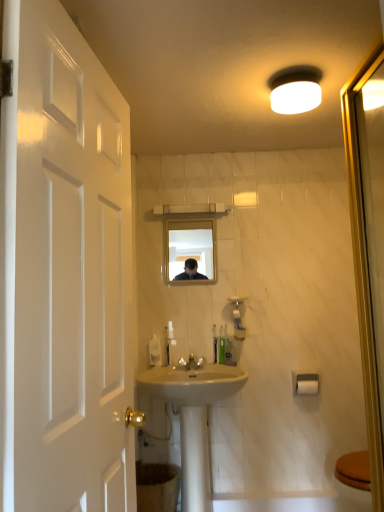
Question: In terms of width, does brown textured toilet bowl at lower center look wider or thinner when compared to white plastic soap dispenser at center?

Choices:
 (A) thin
 (B) wide

Answer: (B)

Question: From a real-world perspective, is brown textured toilet bowl at lower center physically located above or below white plastic soap dispenser at center?

Choices:
 (A) below
 (B) above

Answer: (A)

Question: Estimate the real-world distances between objects in this image. Which object is farther from the white matte light fixture at upper center?

Choices:
 (A) green plastic toothbrush at center
 (B) translucent plastic toothbrush at center, arranged as the 2th toiletry when viewed from the left
 (C) translucent plastic soap dispenser at center, placed as the second toiletry when sorted from right to left
 (D) white plastic soap dispenser at center
 (E) clear glass mirror at center

Answer: (E)

Question: Which is nearer to the clear glass mirror at center?

Choices:
 (A) white glossy door at left
 (B) white matte toilet paper at lower right
 (C) translucent plastic soap dispenser at center, the first toiletry viewed from the left
 (D) white glossy faucet at center
 (E) green plastic toothbrush at center

Answer: (E)